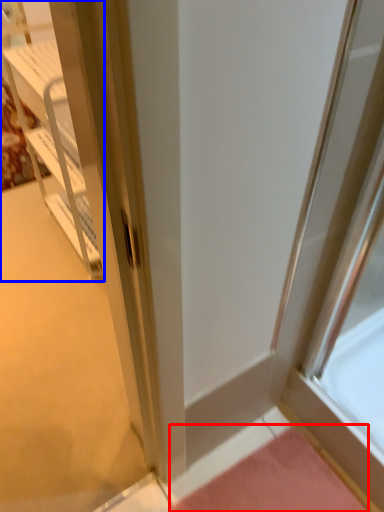
Question: Which point is further to the camera, doormat (highlighted by a red box) or cabinetry (highlighted by a blue box)?

Choices:
 (A) doormat
 (B) cabinetry

Answer: (B)